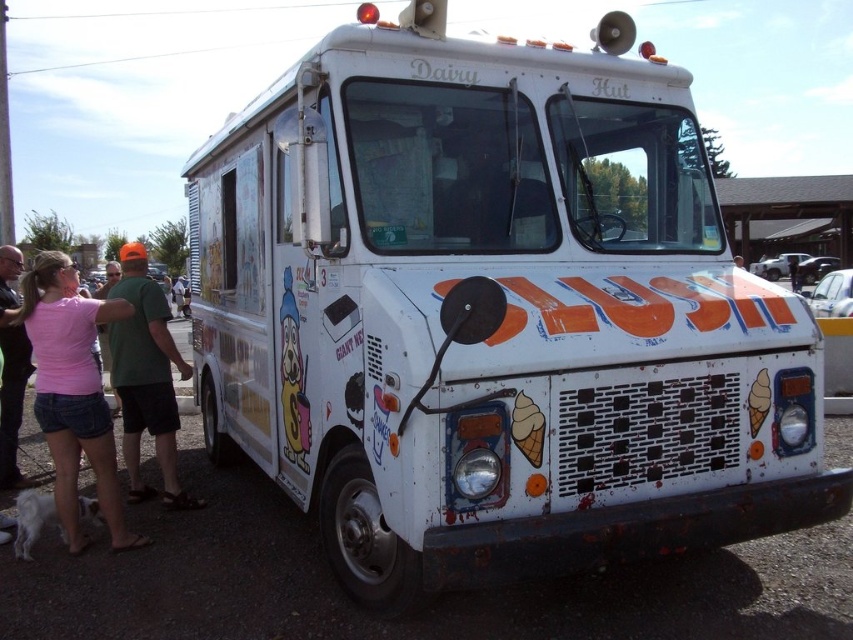
You are standing at the point marked as point (x=148, y=385) and want to take a photo of the vintage ice cream truck. The camera you are using has a focal length of 50mm and a sensor size of 24mm x 36mm. What is the minimum distance you need to move closer to the truck to ensure the entire truck fits within the camera frame?

The point (x=148, y=385) and camera are 5.32 meters apart from each other. To calculate the minimum distance needed, first determine the field of view of the camera. The horizontal field of view is 2 arctan, and the vertical field of view is 2 arctan. The truck must fit within both dimensions. The truck is 5.32 meters away, so the required distance would be the lesser of the horizontal and vertical calculations. However, without knowing the truck dimensions, it is impossible to determine the exact distance.

You are a customer standing in front of the vintage ice cream truck. You notice two shirts hanging on the side of the truck. The pink fabric shirt at lower left and the green fabric shirt at left. Which shirt is closer to the bottom of the truck?

The pink fabric shirt at lower left is closer to the bottom of the truck since it is positioned lower than the green fabric shirt at left.

You are standing in front of the vintage ice cream truck and notice a pink fabric shirt at lower left. Where exactly is the pink fabric shirt located in relation to the truck?

The pink fabric shirt at lower left is located at point 0.613 on the x axis and 0.087 on the y axis relative to the truck.